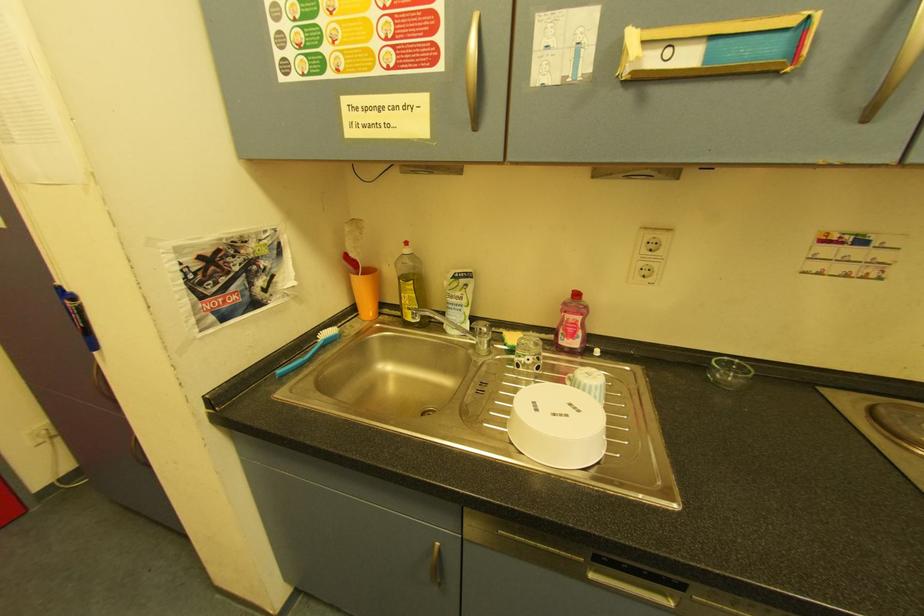
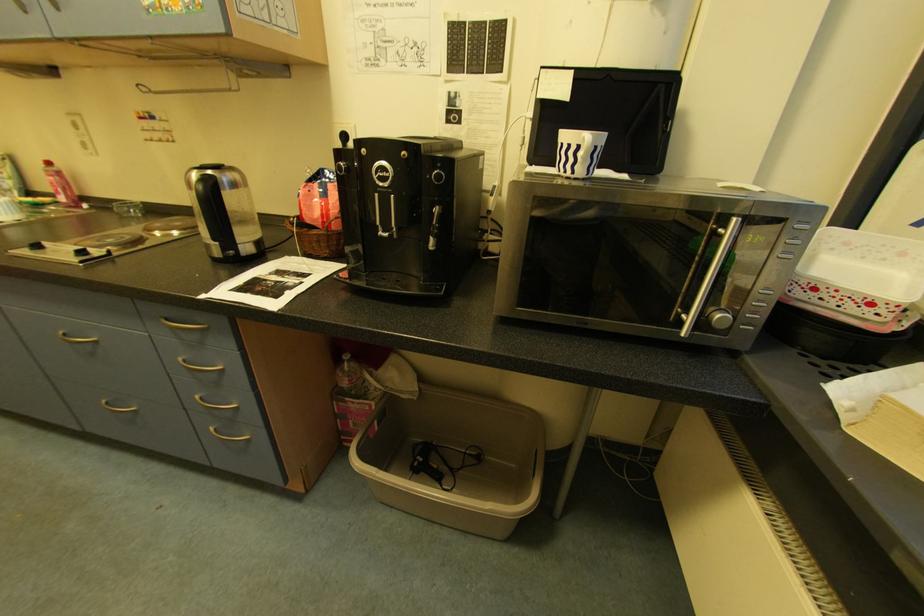
Question: Which direction would the cameraman need to move to produce the second image? Reply with the corresponding letter.

Choices:
 (A) Left
 (B) Right
 (C) Forward
 (D) Backward

Answer: (B)